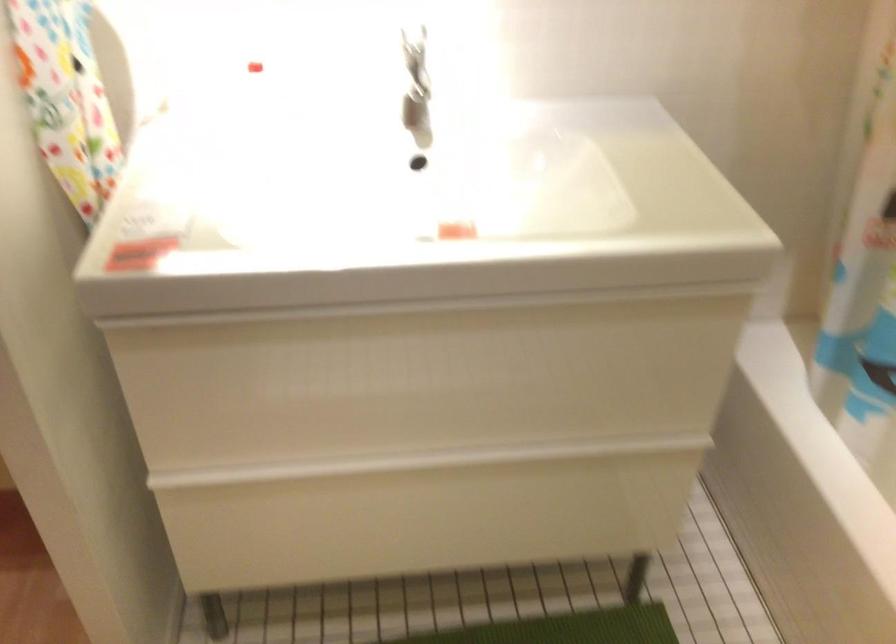
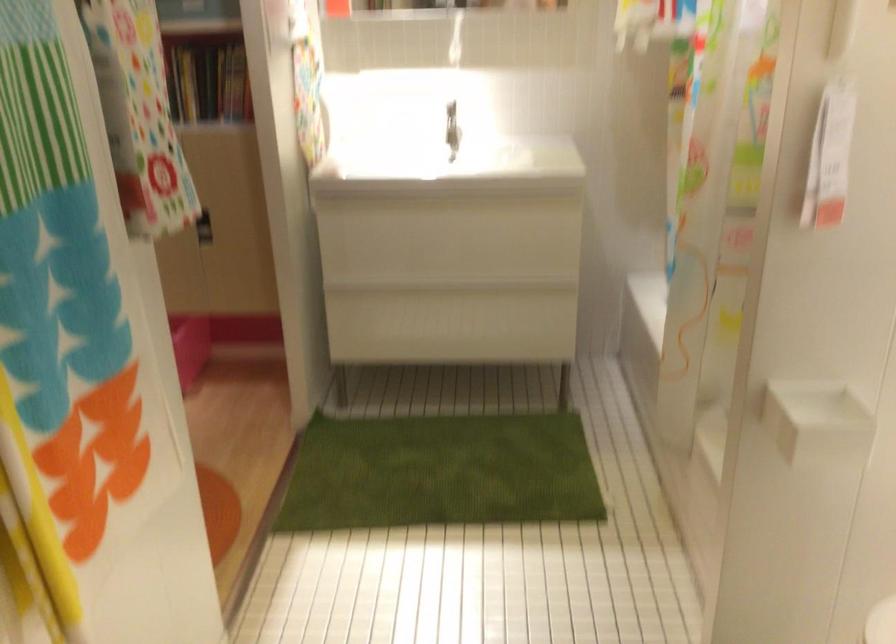
Locate, in the second image, the point that corresponds to (443,460) in the first image.

(453, 288)